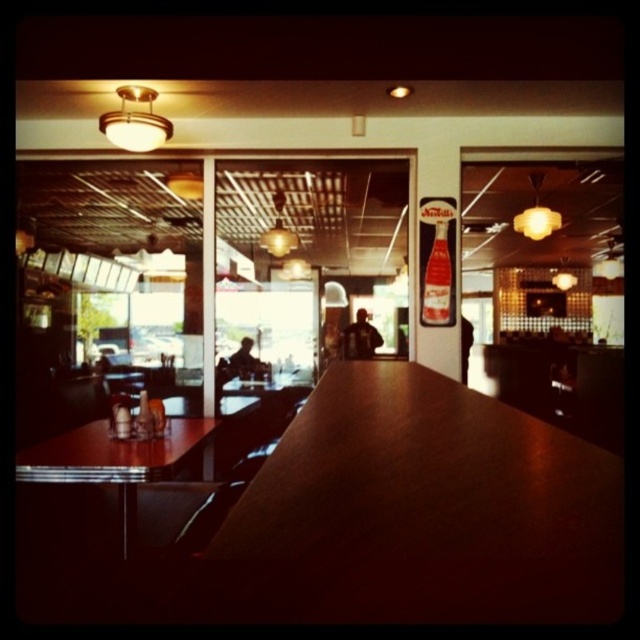
Can you confirm if wooden table at left is positioned to the right of translucent glass bottle at center?

No, wooden table at left is not to the right of translucent glass bottle at center.

Which is in front, point (115, 449) or point (435, 304)?

Point (115, 449) is more forward.

Describe the element at coordinates (109, 456) in the screenshot. I see `wooden table at left` at that location.

You are a GUI agent. You are given a task and a screenshot of the screen. Output one action in this format:
    pyautogui.click(x=<x>, y=<y>)
    Task: Click on the wooden table at left
    The width and height of the screenshot is (640, 640).
    Given the screenshot: What is the action you would take?
    pyautogui.click(x=109, y=456)

The height and width of the screenshot is (640, 640). What are the coordinates of `wooden table at center` in the screenshot? It's located at (420, 513).

Which is more to the left, wooden table at center or wooden table at left?

Positioned to the left is wooden table at left.

Does point (323, 406) come farther from viewer compared to point (122, 531)?

No, it is in front of (122, 531).

This screenshot has width=640, height=640. What are the coordinates of `wooden table at center` in the screenshot? It's located at (420, 513).

Who is more forward, (513, 481) or (138, 403)?

Point (513, 481) is in front.

Can you confirm if wooden table at center is positioned to the left of matte plastic bottle at center?

Incorrect, wooden table at center is not on the left side of matte plastic bottle at center.

Which is in front, point (474, 516) or point (134, 424)?

Point (474, 516) is in front.

Identify the location of wooden table at center. (420, 513).